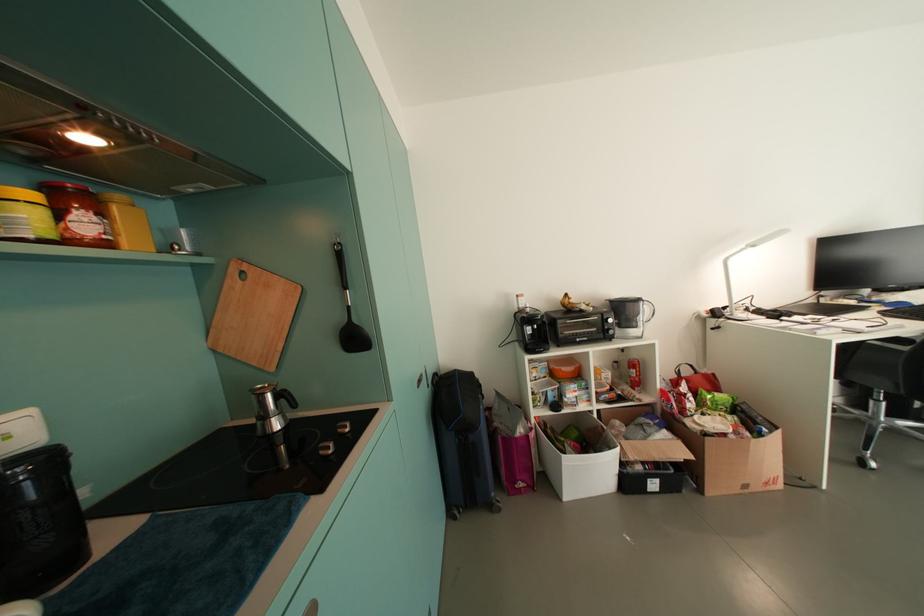
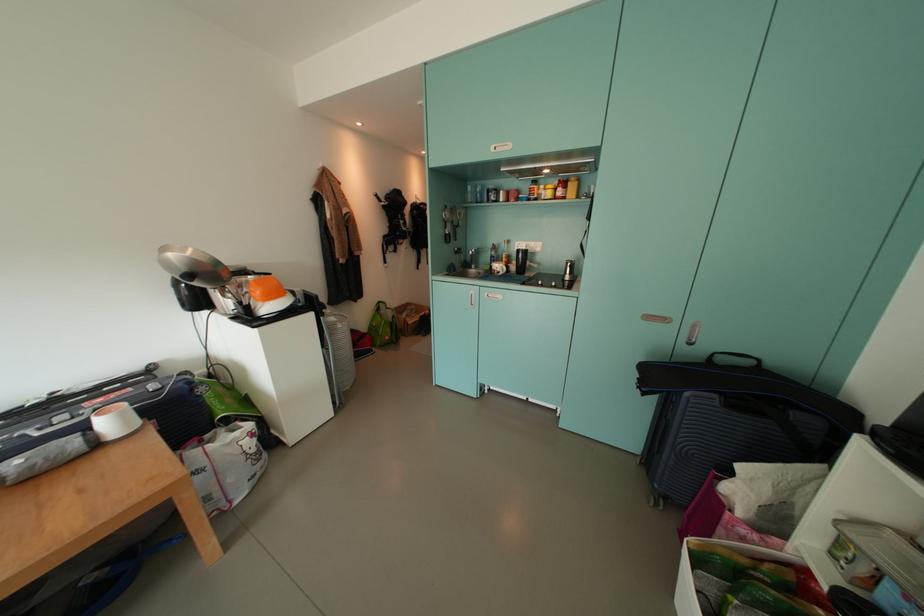
In the second image, find the point that corresponds to point (93, 228) in the first image.

(566, 195)